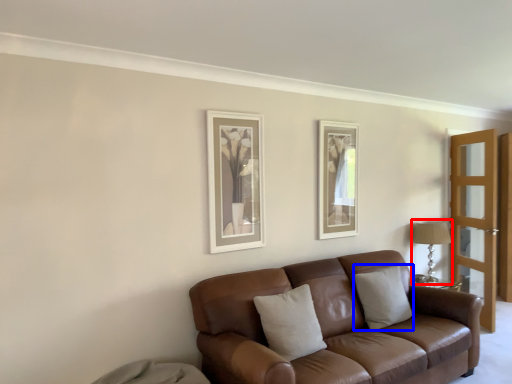
Question: Which of the following is the farthest to the observer, table lamp (highlighted by a red box) or pillow (highlighted by a blue box)?

Choices:
 (A) table lamp
 (B) pillow

Answer: (A)